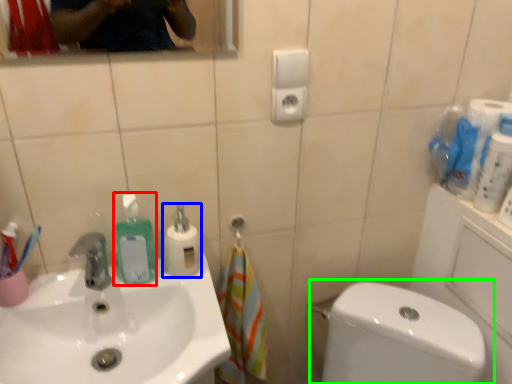
Question: Based on their relative distances, which object is nearer to cleaning product (highlighted by a red box)? Choose from cleaning product (highlighted by a blue box) and toilet (highlighted by a green box).

Choices:
 (A) cleaning product
 (B) toilet

Answer: (A)